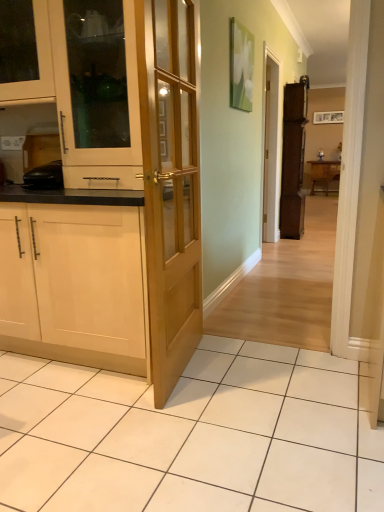
Question: Can you confirm if wooden table at right is bigger than white wood cabinet at left, placed as the third cabinetry when sorted from left to right?

Choices:
 (A) no
 (B) yes

Answer: (B)

Question: From a real-world perspective, is wooden table at right below white wood cabinet at left, the 2th cabinetry in the front-to-back sequence?

Choices:
 (A) no
 (B) yes

Answer: (B)

Question: Would you say wooden table at right is a long distance from white wood cabinet at left, placed as the third cabinetry when sorted from left to right?

Choices:
 (A) no
 (B) yes

Answer: (B)

Question: Is wooden table at right next to white wood cabinet at left, the 2th cabinetry in the front-to-back sequence, and touching it?

Choices:
 (A) yes
 (B) no

Answer: (B)

Question: From the image's perspective, is wooden table at right on top of white wood cabinet at left, the 2th cabinetry in the front-to-back sequence?

Choices:
 (A) yes
 (B) no

Answer: (A)

Question: From a real-world perspective, is matte wood cabinet at upper left, marked as the 1th cabinetry in a left-to-right arrangement, above or below white wood cabinet at left, the 3th cabinetry when ordered from back to front?

Choices:
 (A) below
 (B) above

Answer: (B)

Question: Considering the positions of matte wood cabinet at upper left, the 2th cabinetry from the back, and white wood cabinet at left, placed as the third cabinetry when sorted from left to right, in the image, is matte wood cabinet at upper left, the 2th cabinetry from the back, taller or shorter than white wood cabinet at left, placed as the third cabinetry when sorted from left to right,?

Choices:
 (A) tall
 (B) short

Answer: (B)

Question: Is point pyautogui.click(x=16, y=93) positioned closer to the camera than point pyautogui.click(x=11, y=120)?

Choices:
 (A) farther
 (B) closer

Answer: (B)

Question: From the image's perspective, is matte wood cabinet at upper left, which is the fourth cabinetry in right-to-left order, located above or below white wood cabinet at left, the 3th cabinetry when ordered from back to front?

Choices:
 (A) below
 (B) above

Answer: (B)

Question: Considering the relative positions of light wood cabinet at left, which appears as the second cabinetry when viewed from the left, and light wood door at center in the image provided, is light wood cabinet at left, which appears as the second cabinetry when viewed from the left, to the left or to the right of light wood door at center?

Choices:
 (A) right
 (B) left

Answer: (B)

Question: Is point (14, 318) positioned closer to the camera than point (165, 252)?

Choices:
 (A) closer
 (B) farther

Answer: (B)

Question: From the image's perspective, is light wood cabinet at left, which appears as the second cabinetry when viewed from the left, located above or below light wood door at center?

Choices:
 (A) above
 (B) below

Answer: (B)

Question: From their relative heights in the image, would you say light wood cabinet at left, positioned as the third cabinetry in right-to-left order, is taller or shorter than light wood door at center?

Choices:
 (A) short
 (B) tall

Answer: (A)

Question: Based on their positions, is brown wooden cabinet at right, the fourth cabinetry from the left, located to the left or right of white wood cabinet at left, the 2th cabinetry in the front-to-back sequence?

Choices:
 (A) right
 (B) left

Answer: (A)

Question: In the image, is brown wooden cabinet at right, which is the first cabinetry in right-to-left order, positioned in front of or behind white wood cabinet at left, positioned as the 2th cabinetry in right-to-left order?

Choices:
 (A) behind
 (B) front

Answer: (A)